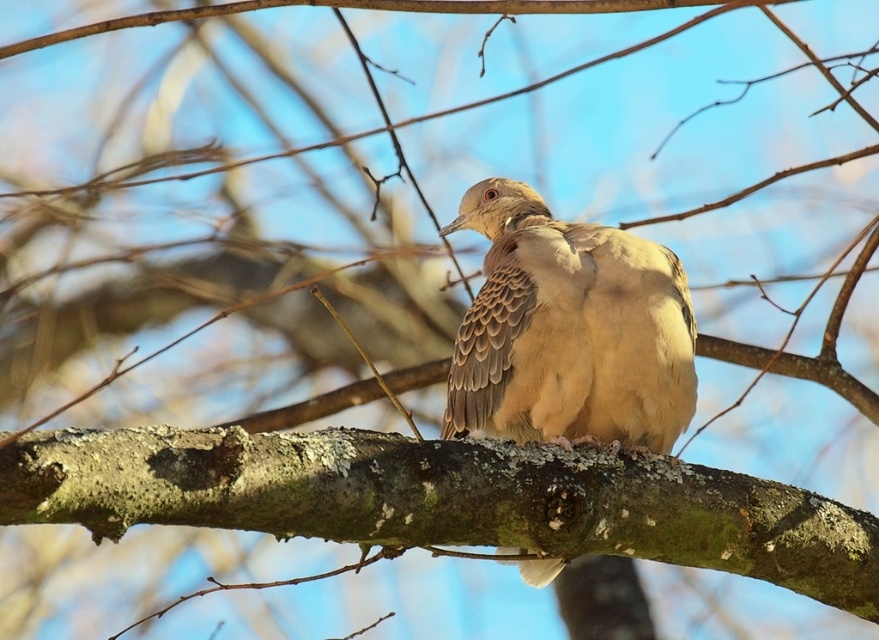
Question: Which point is closer to the camera taking this photo?

Choices:
 (A) (634, 531)
 (B) (687, 374)

Answer: (A)

Question: Considering the relative positions of green mossy branch at center and brown speckled feathers at center in the image provided, where is green mossy branch at center located with respect to brown speckled feathers at center?

Choices:
 (A) above
 (B) below

Answer: (B)

Question: Which point is closer to the camera?

Choices:
 (A) green mossy branch at center
 (B) brown speckled feathers at center

Answer: (A)

Question: Where is green mossy branch at center located in relation to brown speckled feathers at center in the image?

Choices:
 (A) below
 (B) above

Answer: (A)

Question: Observing the image, what is the correct spatial positioning of green mossy branch at center in reference to brown speckled feathers at center?

Choices:
 (A) below
 (B) above

Answer: (A)

Question: Among these objects, which one is nearest to the camera?

Choices:
 (A) brown speckled feathers at center
 (B) green mossy branch at center

Answer: (B)